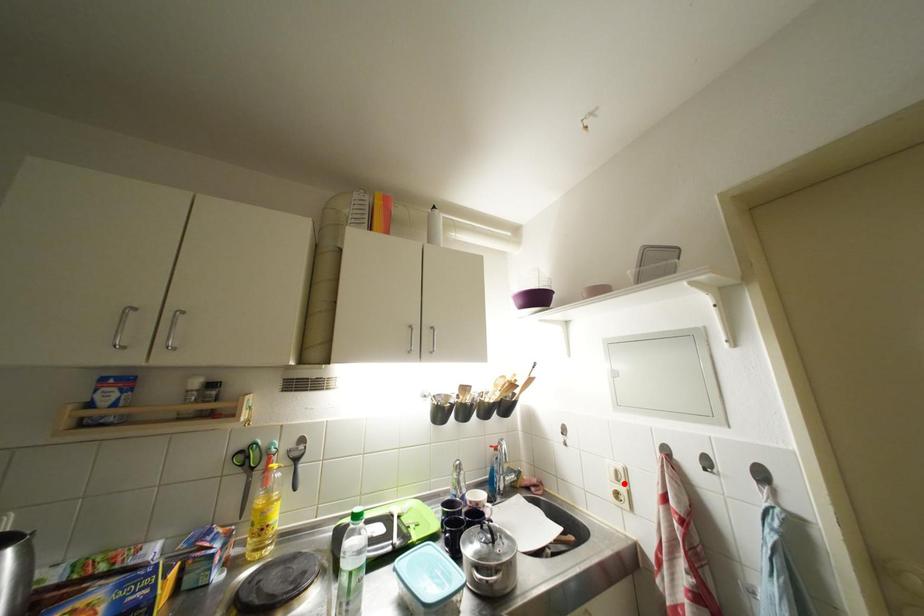
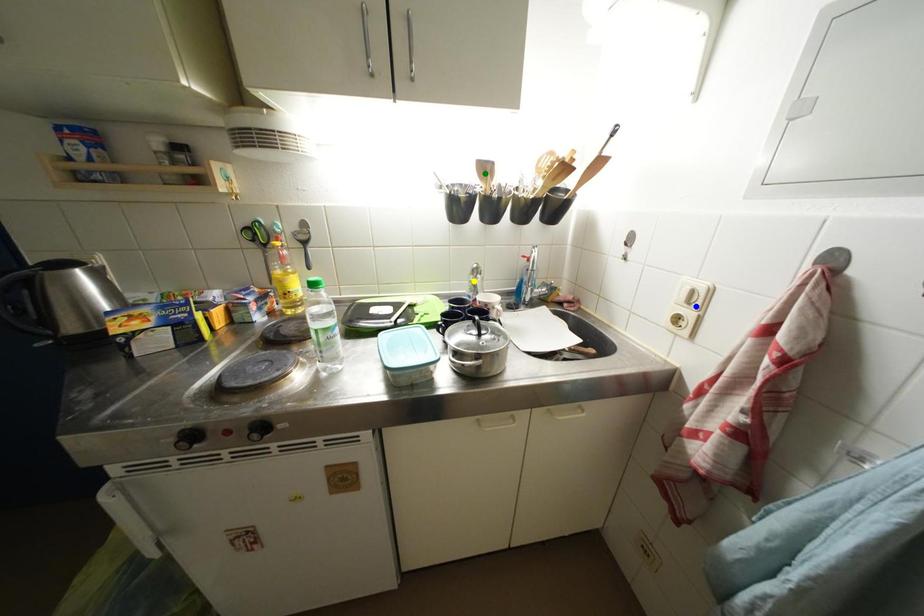
Question: I am providing you with two images of the same scene from different viewpoints. A red point is marked on the first image. You are given multiple points on the second image. Can you choose the point in image 2 that corresponds to the point in image 1?

Choices:
 (A) green point
 (B) yellow point
 (C) blue point

Answer: (C)